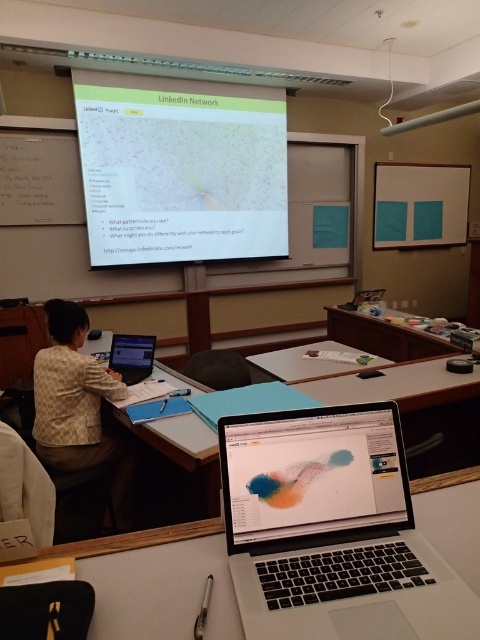
Question: Observing the image, what is the correct spatial positioning of silver metallic laptop at center in reference to matte plastic laptop at center?

Choices:
 (A) right
 (B) left

Answer: (A)

Question: Estimate the real-world distances between objects in this image. Which object is farther from the wooden table at center?

Choices:
 (A) matte plastic laptop at center
 (B) matte black laptop at center

Answer: (A)

Question: Is wooden table at center bigger than matte black laptop at center?

Choices:
 (A) no
 (B) yes

Answer: (B)

Question: Is silver metallic laptop at center to the left of matte plastic laptop at center from the viewer's perspective?

Choices:
 (A) yes
 (B) no

Answer: (B)

Question: Which object appears closest to the camera in this image?

Choices:
 (A) matte plastic laptop at center
 (B) white plastic table at center

Answer: (A)

Question: Which point appears farthest from the camera in this image?

Choices:
 (A) (107, 179)
 (B) (271, 352)
 (C) (116, 365)

Answer: (B)